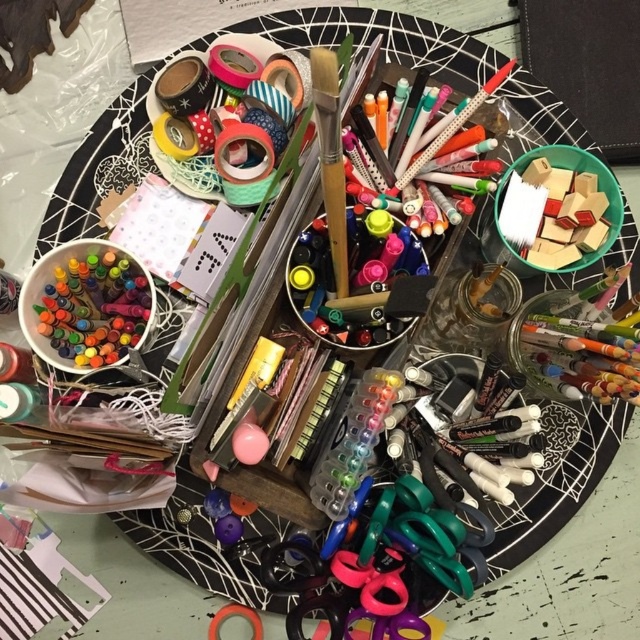
Does point (339, 113) come closer to viewer compared to point (564, 150)?

Yes, point (339, 113) is in front of point (564, 150).

Is point (332, 145) positioned behind point (529, 262)?

No.

Is point (332, 148) behind point (492, 259)?

No, (332, 148) is in front of (492, 259).

Where is `wooden paintbrush at center`? This screenshot has height=640, width=640. wooden paintbrush at center is located at coordinates (330, 160).

Is point (115, 273) farther from camera compared to point (376, 330)?

Yes, it is.

Which of these two, matte plastic crayons at left or matte black markers at center, stands shorter?

matte plastic crayons at left is shorter.

Is point (81, 305) farther from camera compared to point (364, 212)?

Yes, it is behind point (364, 212).

At what (x,y) coordinates should I click in order to perform the action: click on matte plastic crayons at left. Please return your answer as a coordinate pair (x, y). This screenshot has height=640, width=640. Looking at the image, I should click on (86, 305).

Who is higher up, matte plastic crayons at left or wooden paintbrush at center?

wooden paintbrush at center

Find the location of `matte plastic crayons at left`. matte plastic crayons at left is located at coordinates (86, 305).

Which is behind, point (134, 257) or point (340, 172)?

The point (134, 257) is more distant.

Locate an element on the screen. Image resolution: width=640 pixels, height=640 pixels. matte plastic crayons at left is located at coordinates (86, 305).